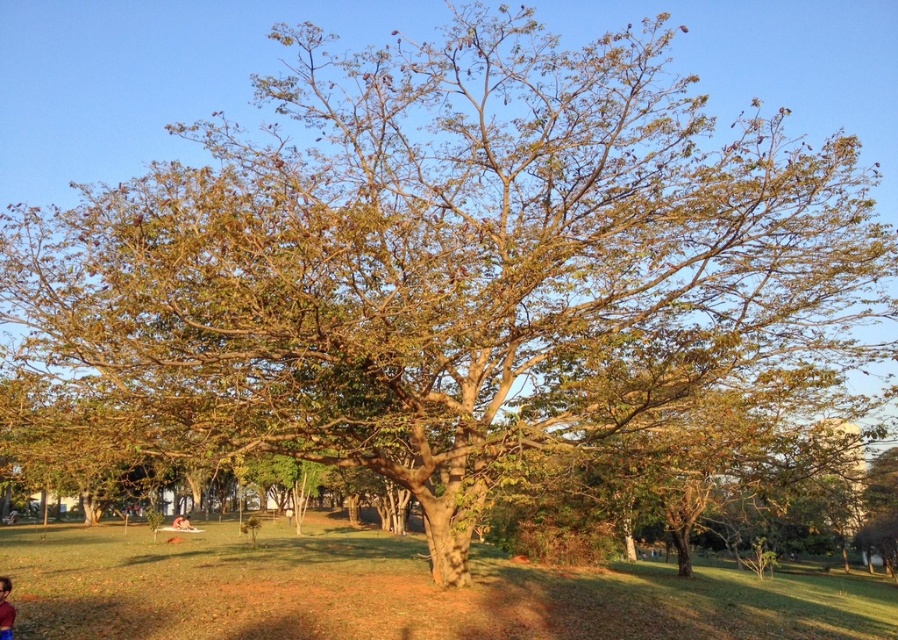
Question: Which point is closer to the camera taking this photo?

Choices:
 (A) (182, 518)
 (B) (2, 605)

Answer: (B)

Question: Which of the following is the closest to the observer?

Choices:
 (A) red shirt at lower left
 (B) light brown skin at lower center

Answer: (A)

Question: Does red shirt at lower left have a greater width compared to light brown skin at lower center?

Choices:
 (A) yes
 (B) no

Answer: (B)

Question: In this image, where is red shirt at lower left located relative to light brown skin at lower center?

Choices:
 (A) below
 (B) above

Answer: (B)

Question: Can you confirm if red shirt at lower left is positioned below light brown skin at lower center?

Choices:
 (A) yes
 (B) no

Answer: (B)